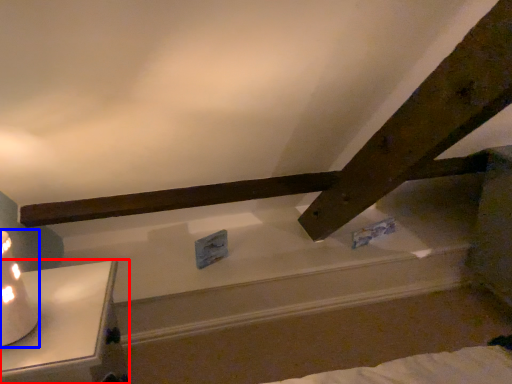
Question: Which object is closer to the camera taking this photo, furniture (highlighted by a red box) or table lamp (highlighted by a blue box)?

Choices:
 (A) furniture
 (B) table lamp

Answer: (B)